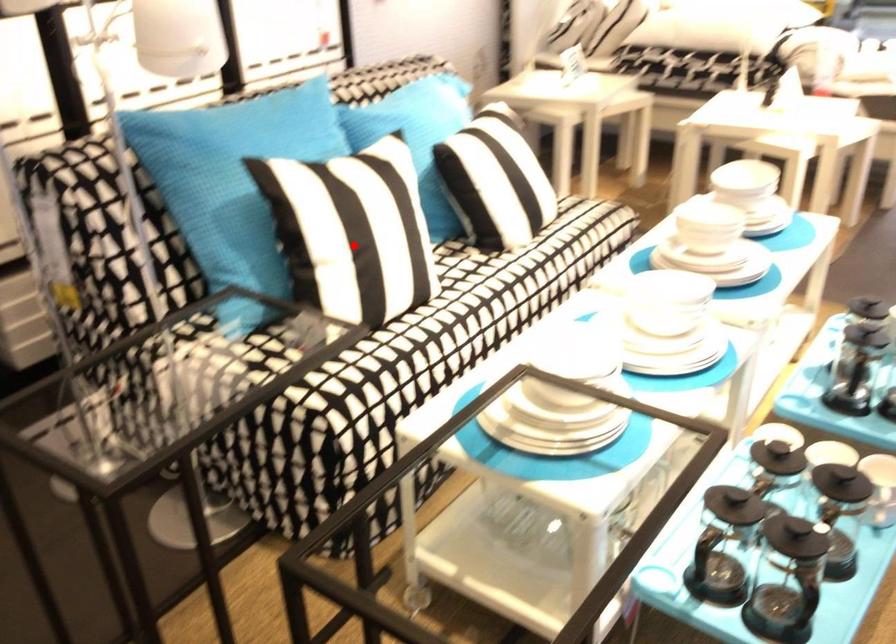
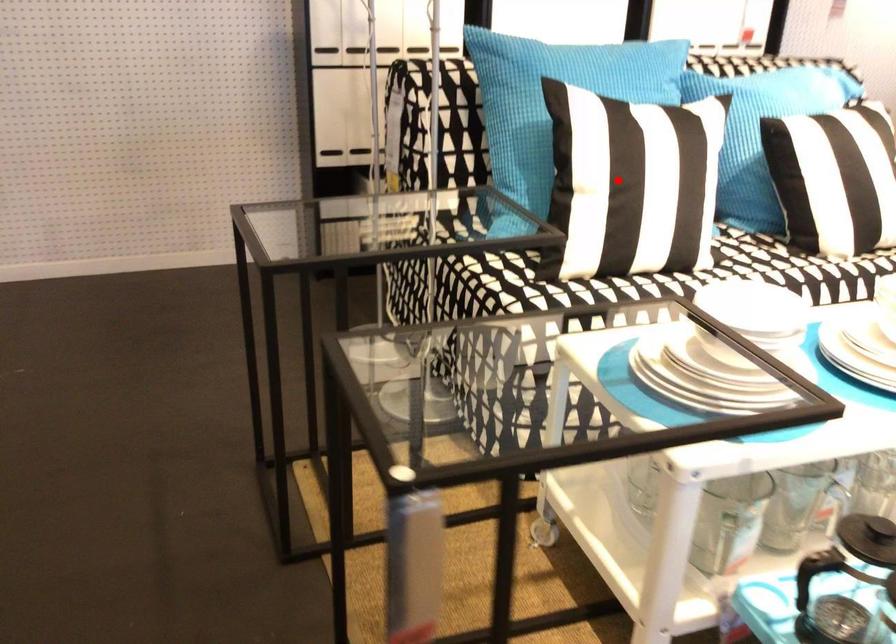
I am providing you with two images of the same scene from different viewpoints. A red point is marked on the first image and another point is marked on the second image. Does the point marked in image1 correspond to the same location as the one in image2?

Yes